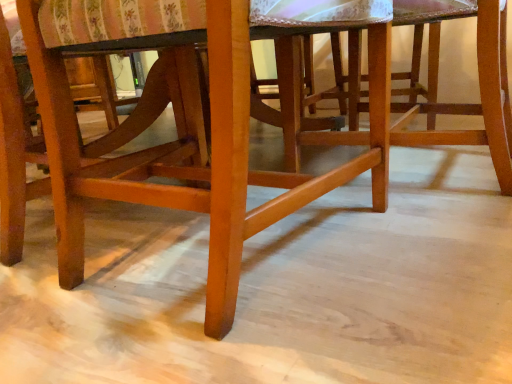
Question: Does point (77, 48) appear closer or farther from the camera than point (287, 135)?

Choices:
 (A) closer
 (B) farther

Answer: (A)

Question: Looking at the image, does wooden chair at center seem bigger or smaller compared to wooden stool at center?

Choices:
 (A) small
 (B) big

Answer: (B)

Question: Visually, is wooden chair at center positioned to the left or to the right of wooden stool at center?

Choices:
 (A) right
 (B) left

Answer: (B)

Question: Is wooden stool at center inside or outside of wooden chair at center?

Choices:
 (A) outside
 (B) inside

Answer: (A)

Question: Looking at their shapes, would you say wooden stool at center is wider or thinner than wooden chair at center?

Choices:
 (A) thin
 (B) wide

Answer: (A)

Question: Considering the positions of wooden stool at center and wooden chair at center in the image, is wooden stool at center taller or shorter than wooden chair at center?

Choices:
 (A) tall
 (B) short

Answer: (B)

Question: Does point (294, 140) appear closer or farther from the camera than point (387, 92)?

Choices:
 (A) closer
 (B) farther

Answer: (B)